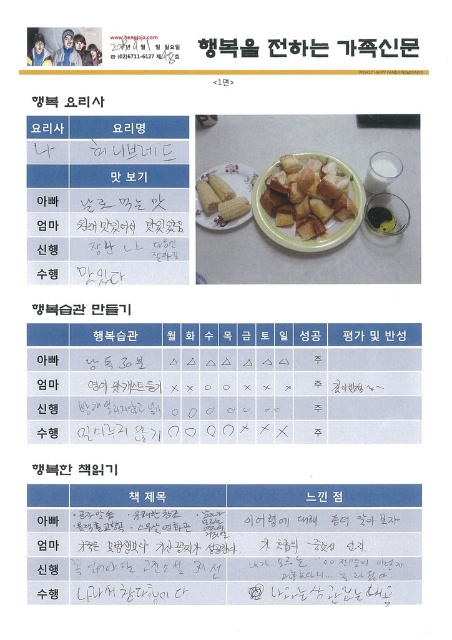
Question: Among these points, which one is nearest to the camera?

Choices:
 (A) (206, 227)
 (B) (347, 236)

Answer: (B)

Question: Does golden brown croutons at center appear on the right side of yellow matte corn at center?

Choices:
 (A) yes
 (B) no

Answer: (A)

Question: Which of the following is the closest to the observer?

Choices:
 (A) golden brown croutons at center
 (B) yellow matte corn at center

Answer: (A)

Question: Does golden brown croutons at center appear on the right side of yellow matte corn at center?

Choices:
 (A) no
 (B) yes

Answer: (B)

Question: Observing the image, what is the correct spatial positioning of golden brown croutons at center in reference to yellow matte corn at center?

Choices:
 (A) left
 (B) right

Answer: (B)